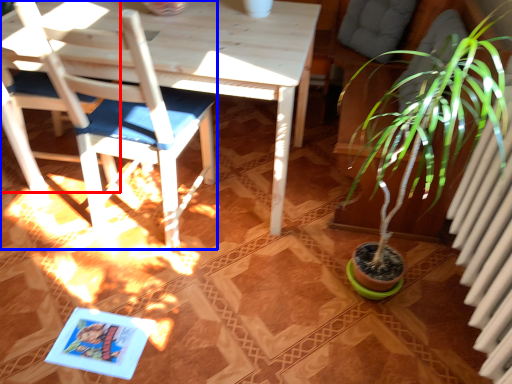
Question: Among these objects, which one is farthest to the camera, chair (highlighted by a red box) or chair (highlighted by a blue box)?

Choices:
 (A) chair
 (B) chair

Answer: (A)